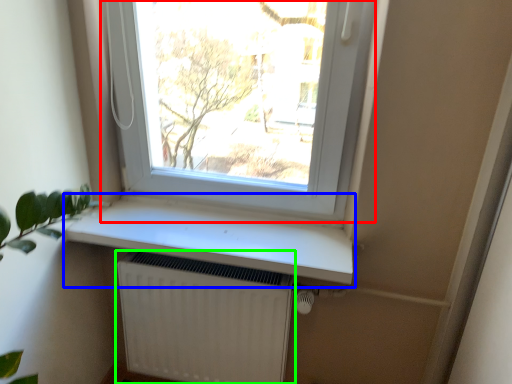
Question: Based on their relative distances, which object is farther from window (highlighted by a red box)? Choose from window sill (highlighted by a blue box) and radiator (highlighted by a green box).

Choices:
 (A) window sill
 (B) radiator

Answer: (B)